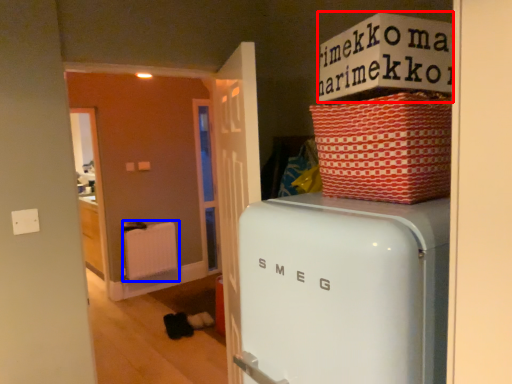
Question: Among these objects, which one is nearest to the camera, cardboard box (highlighted by a red box) or radiator (highlighted by a blue box)?

Choices:
 (A) cardboard box
 (B) radiator

Answer: (A)